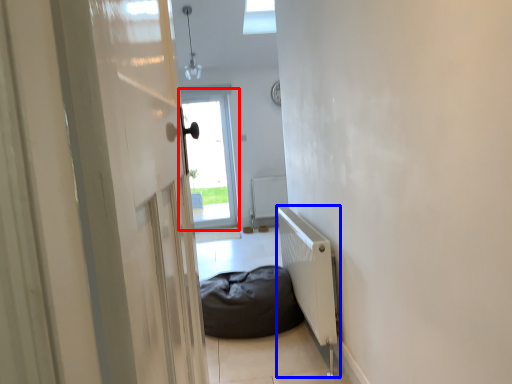
Question: Among these objects, which one is farthest to the camera, window (highlighted by a red box) or radiator (highlighted by a blue box)?

Choices:
 (A) window
 (B) radiator

Answer: (A)